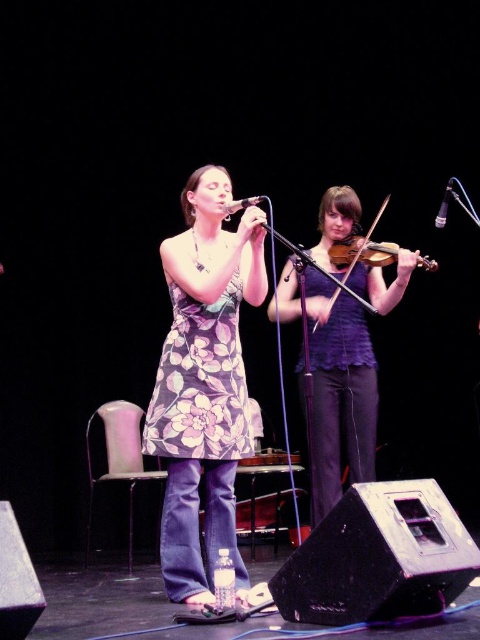
Question: Which object is positioned farthest from the floral-patterned fabric dress at center?

Choices:
 (A) purple textured top at center
 (B) floral-patterned dress at center
 (C) wooden violin at center

Answer: (C)

Question: Does floral-patterned dress at center come behind purple textured top at center?

Choices:
 (A) yes
 (B) no

Answer: (B)

Question: Does floral-patterned fabric dress at center have a larger size compared to wooden violin at center?

Choices:
 (A) yes
 (B) no

Answer: (B)

Question: Is the position of floral-patterned dress at center more distant than that of floral-patterned fabric dress at center?

Choices:
 (A) yes
 (B) no

Answer: (B)

Question: Which of the following is the farthest from the observer?

Choices:
 (A) (347, 193)
 (B) (255, 272)
 (C) (218, 308)
 (D) (365, 422)

Answer: (A)

Question: Among these objects, which one is nearest to the camera?

Choices:
 (A) floral-patterned dress at center
 (B) wooden violin at center

Answer: (A)